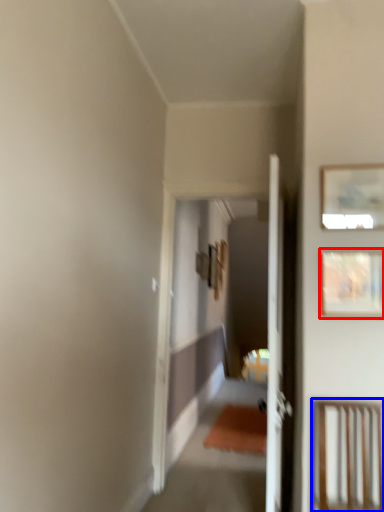
Question: Which point is further to the camera, picture frame (highlighted by a red box) or furniture (highlighted by a blue box)?

Choices:
 (A) picture frame
 (B) furniture

Answer: (A)